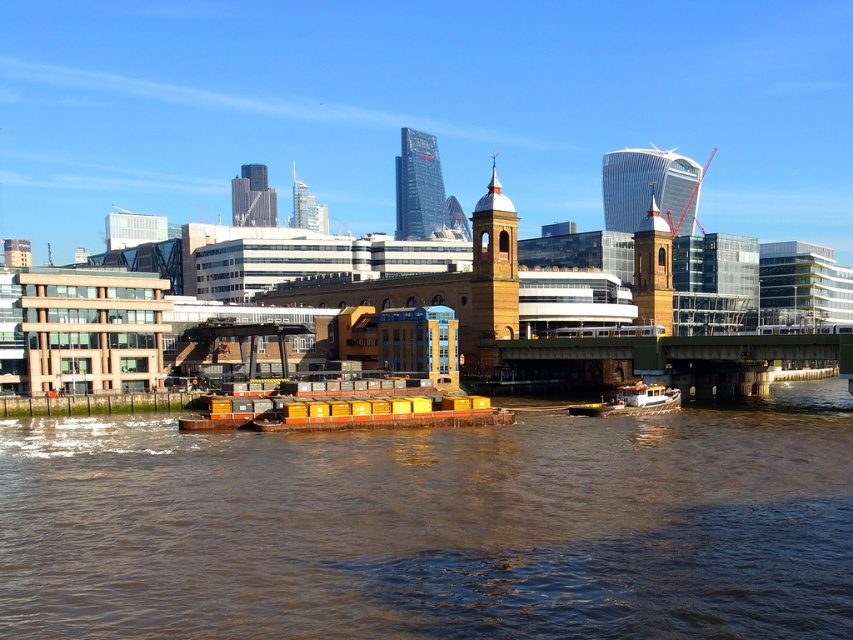
You are a photographer planning to take a photo of the white wooden boat at center from the riverbank. Considering the height of the brown muddy water at center, will you need to adjust your camera angle upwards or downwards to capture the boat in the shot?

The brown muddy water at center is not as tall as the white wooden boat at center, so you will need to adjust your camera angle upwards to capture the boat in the shot since the boat is taller than the water level.

You are a photographer planning to capture the skyline of the city from the riverbank. You have two boats available for your photography session, the yellow matte container ship at center and the white wooden boat at center. Which boat should you choose to get a higher vantage point for your shots?

The yellow matte container ship at center has a greater height compared to the white wooden boat at center, so choosing the yellow matte container ship at center will provide a higher vantage point for capturing the skyline.

You are standing at the riverbank looking at the buildings in the scene. There are two points marked on the buildings in the midground. One is at coordinates point [434,396] and the other at point [664,392]. Which point is closer to you?

Point [434,396] is closer to the viewer than point [664,392].